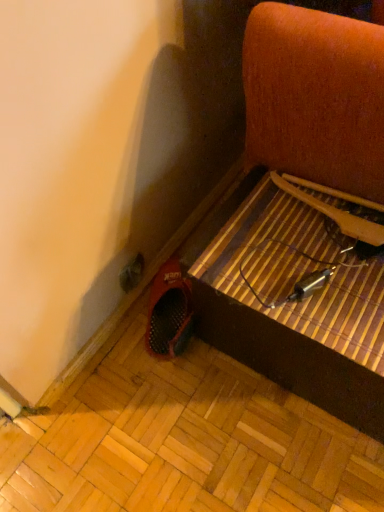
In order to click on wooden chair at lower right in this screenshot , I will do `click(302, 215)`.

Describe the element at coordinates (302, 215) in the screenshot. I see `wooden chair at lower right` at that location.

At what (x,y) coordinates should I click in order to perform the action: click on wooden chair at lower right. Please return your answer as a coordinate pair (x, y). Looking at the image, I should click on (302, 215).